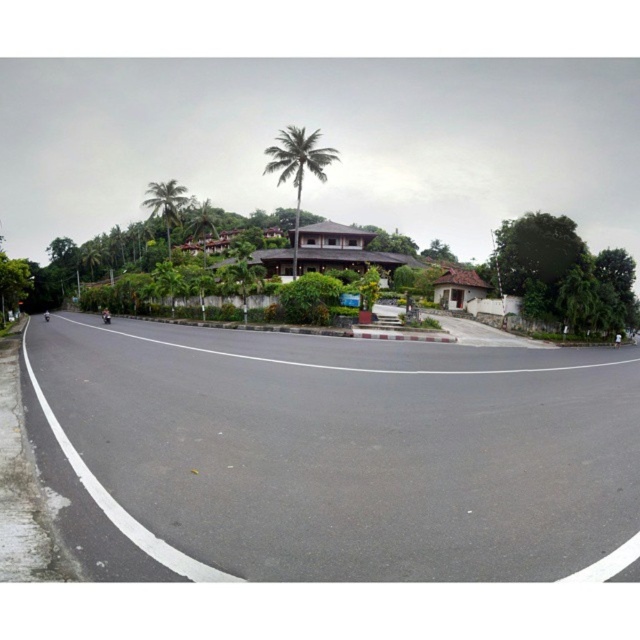
You are a delivery driver planning to drive a truck that is 8 feet wide along the black asphalt road at lower left. The road has a no passing zone marked by solid white lines. There is a green leafy palm tree at center nearby. Can your truck safely pass through the area without encroaching on the opposite lane or hitting the tree?

The distance between the black asphalt road at lower left and the green leafy palm tree at center is 75.15 feet. Since the truck is only 8 feet wide, there is sufficient space to safely navigate the road without encroaching on the opposite lane or hitting the tree.

You are driving a car that is 4.5 meters long and want to pass between the green leafy palm tree at center and the green leafy palm tree at upper center. Can your car fit through the space between them?

The distance between the green leafy palm tree at center and the green leafy palm tree at upper center is 14.09 meters. Since your car is only 4.5 meters long, it can easily fit through the space between them.

You are driving a car and see the black asphalt road at lower left and the green leafy palm tree at upper center. Which object is closer to you from your driving perspective?

The black asphalt road at lower left is closer to you because it is in front of the green leafy palm tree at upper center.